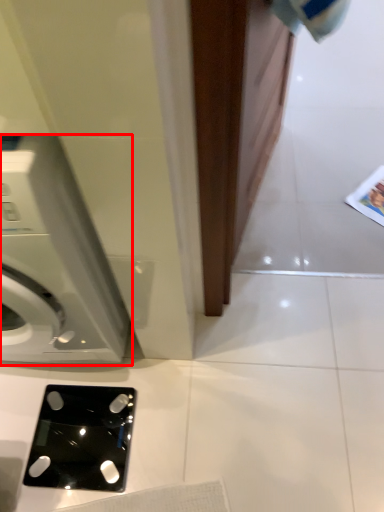
Question: Where is washing machine (annotated by the red box) located in relation to ipod in the image?

Choices:
 (A) right
 (B) left

Answer: (B)